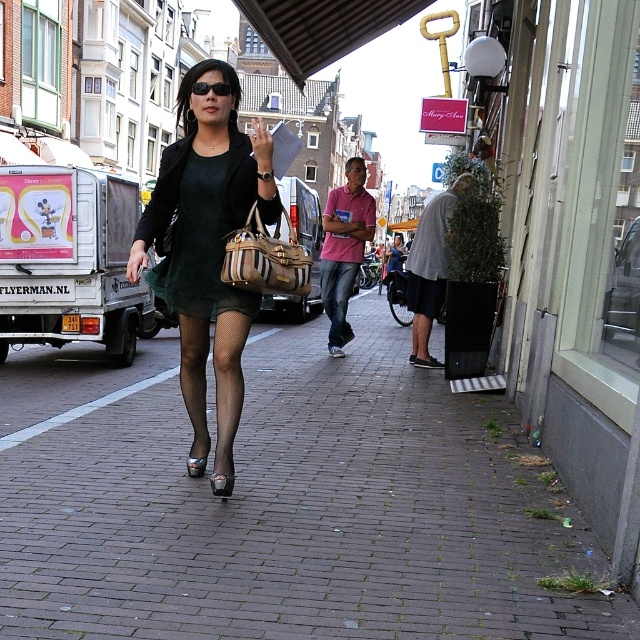
Can you confirm if green matte dress at center is taller than green sheer dress at center?

In fact, green matte dress at center may be shorter than green sheer dress at center.

Between green matte dress at center and green sheer dress at center, which one has more height?

green sheer dress at center is taller.

Is point (230, 188) farther from viewer compared to point (241, 156)?

No, it is in front of (241, 156).

You are a GUI agent. You are given a task and a screenshot of the screen. Output one action in this format:
    pyautogui.click(x=<x>, y=<y>)
    Task: Click on the green matte dress at center
    
    Given the screenshot: What is the action you would take?
    pyautogui.click(x=209, y=244)

Is brick pavement at center wider than pink cotton shirt at center?

Yes, brick pavement at center is wider than pink cotton shirt at center.

Can you confirm if brick pavement at center is thinner than pink cotton shirt at center?

In fact, brick pavement at center might be wider than pink cotton shirt at center.

I want to click on brick pavement at center, so click(x=282, y=502).

Between pink cotton shirt at center and leather textured handbag at center, which one is positioned higher?

pink cotton shirt at center

Who is more distant from viewer, (336, 202) or (282, 288)?

Positioned behind is point (336, 202).

Between point (344, 214) and point (252, 285), which one is positioned behind?

Point (344, 214)

This screenshot has width=640, height=640. In order to click on pink cotton shirt at center in this screenshot , I will do `click(344, 248)`.